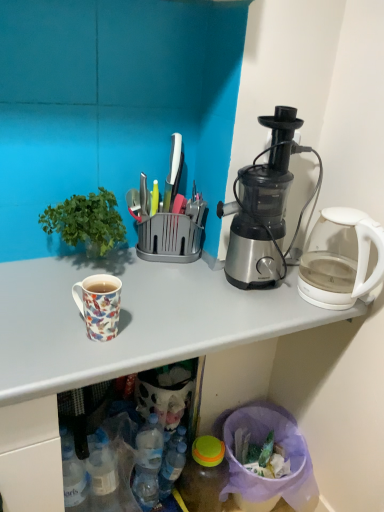
The height and width of the screenshot is (512, 384). Find the location of `unoccupied space behind floral ceramic mug at left`. unoccupied space behind floral ceramic mug at left is located at coordinates (128, 290).